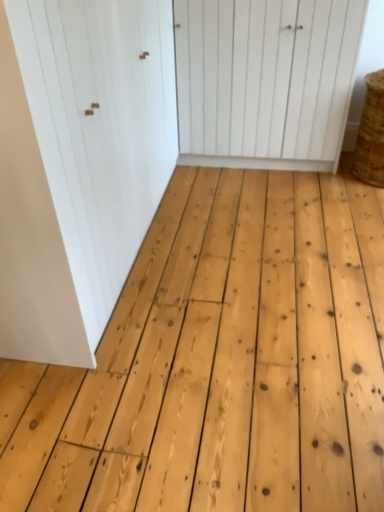
Question: Is white wood door at center, which is the first door from right to left, inside or outside of braided straw basket at right?

Choices:
 (A) inside
 (B) outside

Answer: (B)

Question: From the image's perspective, is white wood door at center, which is the first door from right to left, located above or below braided straw basket at right?

Choices:
 (A) above
 (B) below

Answer: (A)

Question: Based on their relative distances, which object is nearer to the white matte door at upper left, the 1th door in the left-to-right sequence?

Choices:
 (A) white wood door at center, which is counted as the second door, starting from the left
 (B) braided straw basket at right

Answer: (A)

Question: Which of these objects is positioned farthest from the white matte door at upper left, arranged as the 2th door when viewed from the right?

Choices:
 (A) white wood door at center, which is the first door from right to left
 (B) braided straw basket at right

Answer: (B)